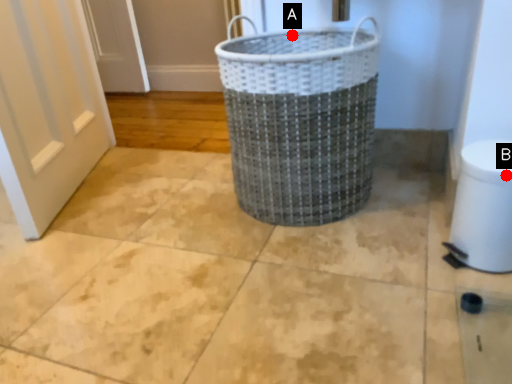
Question: Two points are circled on the image, labeled by A and B beside each circle. Which of the following is the farthest from the observer?

Choices:
 (A) A is further
 (B) B is further

Answer: (A)